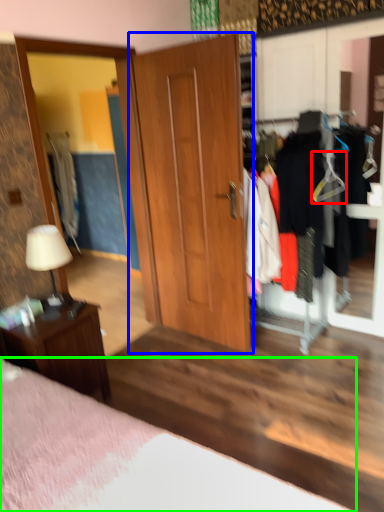
Question: Which is nearer to the hanger (highlighted by a red box)? door (highlighted by a blue box) or bed (highlighted by a green box).

Choices:
 (A) door
 (B) bed

Answer: (A)